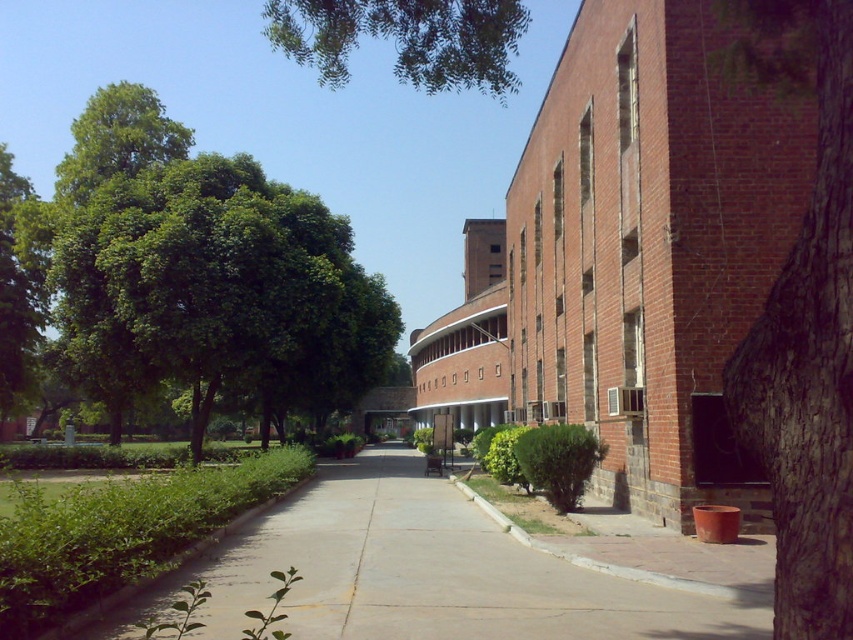
You are a landscape architect designing a garden and need to place two green leafy trees in the scene. The green leafy tree at left and the green leafy tree at upper center must be positioned according to their actual sizes. Which tree should you place in a narrower space to fit its width?

The green leafy tree at left has a lesser width compared to the green leafy tree at upper center, so it should be placed in a narrower space to fit its width.

You are a gardener trying to water the green leafy tree at left and the smooth concrete pavement at center. Which object should you water first if you want to reach them in the order they appear closest to you?

The green leafy tree at left should be watered first because it is closer to you than the smooth concrete pavement at center, which is positioned behind it.

You are standing on the pathway and want to take a photo of both the green leafy tree at left and the brown rough bark tree at right. Which tree should you position closer to the camera to include both in the frame?

To include both the green leafy tree at left and the brown rough bark tree at right in the frame, you should position the green leafy tree at left closer to the camera since it is already on the left side of the brown rough bark tree at right.